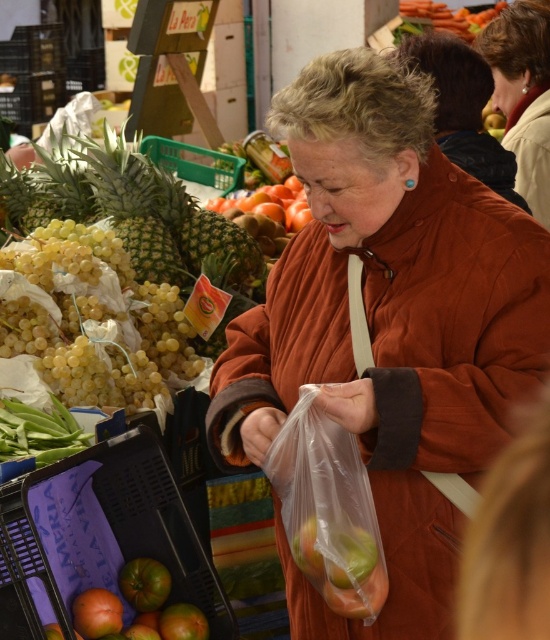
You are a customer at a market and see the brown leather jacket at upper right and the green textured pineapple at upper left. Which item is located more to the right side of the market scene?

The brown leather jacket at upper right is more to the right side of the market scene than the green textured pineapple at upper left.

You are a customer at the fruit market and want to place your shopping basket between the brown leather jacket at upper right and the green textured pineapple at upper left. Can you fit it there?

The brown leather jacket at upper right is much taller than the green textured pineapple at upper left, so the space between them might be sufficient to place the shopping basket. However, since the jacket is taller, the vertical space could accommodate the basket if it is not too large.